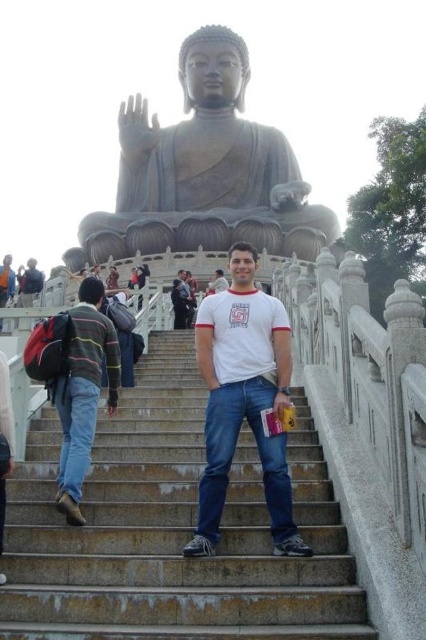
Who is positioned more to the left, smooth stone stairs at center or striped sweater at left?

striped sweater at left

Is point (222, 620) more distant than point (103, 321)?

No, it is not.

I want to click on smooth stone stairs at center, so click(172, 531).

Is white cotton t-shirt at center thinner than striped sweater at left?

Incorrect, white cotton t-shirt at center's width is not less than striped sweater at left's.

Does point (261, 460) lie behind point (86, 282)?

That is False.

Describe the element at coordinates (244, 400) in the screenshot. The image size is (426, 640). I see `white cotton t-shirt at center` at that location.

The image size is (426, 640). In order to click on white cotton t-shirt at center in this screenshot , I will do `click(244, 400)`.

Can you confirm if matte gray statue at center is positioned above dark gray stone statue at upper center?

Correct, matte gray statue at center is located above dark gray stone statue at upper center.

Can you confirm if matte gray statue at center is positioned to the left of dark gray stone statue at upper center?

No, matte gray statue at center is not to the left of dark gray stone statue at upper center.

The width and height of the screenshot is (426, 640). In order to click on matte gray statue at center in this screenshot , I will do `click(203, 161)`.